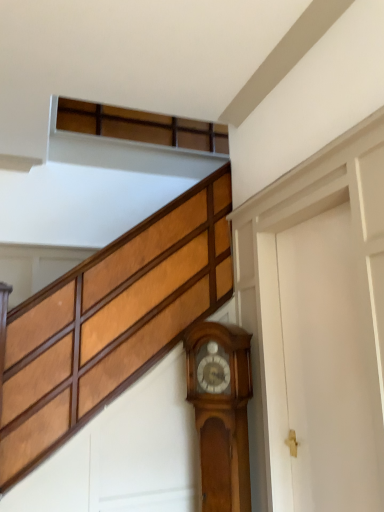
Question: Based on their sizes in the image, would you say white matte door at right is bigger or smaller than polished wood grandfather clock at lower right?

Choices:
 (A) big
 (B) small

Answer: (A)

Question: In terms of height, does white matte door at right look taller or shorter compared to polished wood grandfather clock at lower right?

Choices:
 (A) short
 (B) tall

Answer: (B)

Question: From the image's perspective, relative to polished wood grandfather clock at lower right, is white matte door at right above or below?

Choices:
 (A) below
 (B) above

Answer: (B)

Question: Is polished wood grandfather clock at lower right inside or outside of white matte door at right?

Choices:
 (A) outside
 (B) inside

Answer: (A)

Question: Considering their positions, is polished wood grandfather clock at lower right located in front of or behind white matte door at right?

Choices:
 (A) front
 (B) behind

Answer: (B)

Question: Does point (215, 432) appear closer or farther from the camera than point (327, 477)?

Choices:
 (A) closer
 (B) farther

Answer: (B)

Question: In terms of height, does polished wood grandfather clock at lower right look taller or shorter compared to white matte door at right?

Choices:
 (A) short
 (B) tall

Answer: (A)